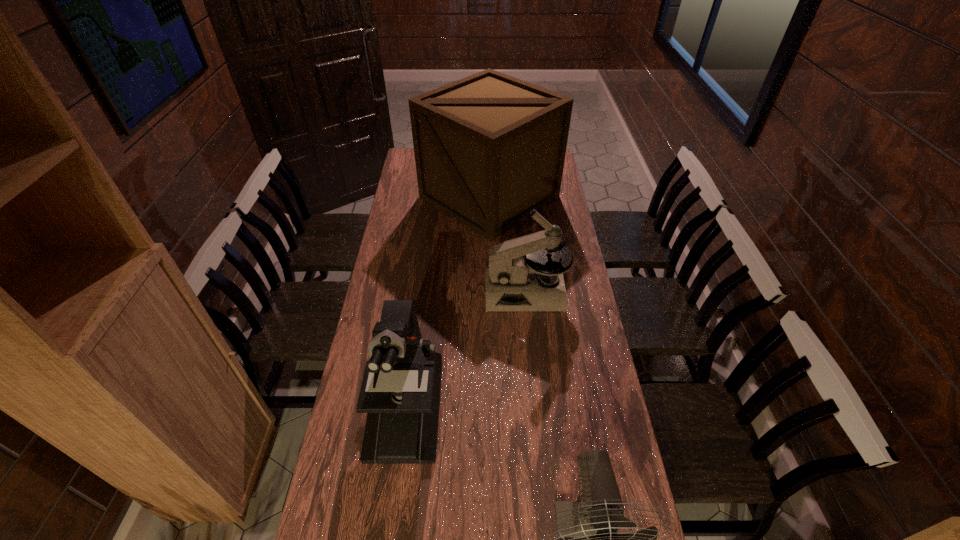
Where is `object that is at the far edge`? This screenshot has width=960, height=540. object that is at the far edge is located at coordinates (488, 148).

Where is `box that is at the left edge`? The width and height of the screenshot is (960, 540). box that is at the left edge is located at coordinates (488, 148).

The image size is (960, 540). Identify the location of microscope at the left edge. (400, 392).

In order to click on box that is at the right edge in this screenshot , I will do `click(488, 148)`.

At what (x,y) coordinates should I click in order to perform the action: click on microscope that is at the right edge. Please return your answer as a coordinate pair (x, y). The image size is (960, 540). Looking at the image, I should click on (512, 280).

Locate an element on the screen. This screenshot has width=960, height=540. object located at the far left corner is located at coordinates (488, 148).

You are a GUI agent. You are given a task and a screenshot of the screen. Output one action in this format:
    pyautogui.click(x=<x>, y=<y>)
    Task: Click on the object that is at the far right corner
    This screenshot has height=540, width=960.
    Given the screenshot: What is the action you would take?
    pyautogui.click(x=488, y=148)

Where is `free space at the left edge`? This screenshot has height=540, width=960. free space at the left edge is located at coordinates (421, 205).

Identify the location of free spot at the right edge of the desktop. (587, 441).

At what (x,y) coordinates should I click in order to perform the action: click on vacant area at the far left corner. Please return your answer as a coordinate pair (x, y). This screenshot has height=540, width=960. Looking at the image, I should click on (405, 157).